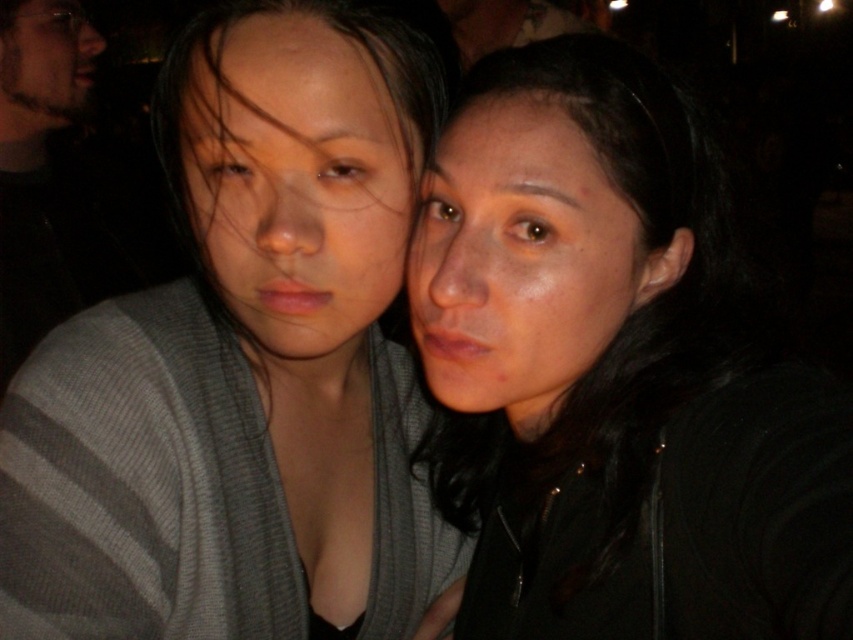
Question: Based on their relative distances, which object is nearer to the matte black hair at center?

Choices:
 (A) gray knitted sweater at center
 (B) beige textured beard at upper left
 (C) matte gray sweater at left
 (D) gray knitted sweater at upper left

Answer: (A)

Question: Does gray knitted sweater at center lie in front of smooth skin face at right?

Choices:
 (A) yes
 (B) no

Answer: (A)

Question: Does gray knitted sweater at center have a smaller size compared to beige textured beard at upper left?

Choices:
 (A) yes
 (B) no

Answer: (B)

Question: Can you confirm if matte gray sweater at left is positioned above smooth skin face at right?

Choices:
 (A) yes
 (B) no

Answer: (A)

Question: Which point is closer to the camera?

Choices:
 (A) matte gray sweater at left
 (B) gray knitted sweater at upper left
 (C) beige textured beard at upper left

Answer: (A)

Question: Among these points, which one is nearest to the camera?

Choices:
 (A) (44, 86)
 (B) (32, 413)
 (C) (811, 612)

Answer: (C)